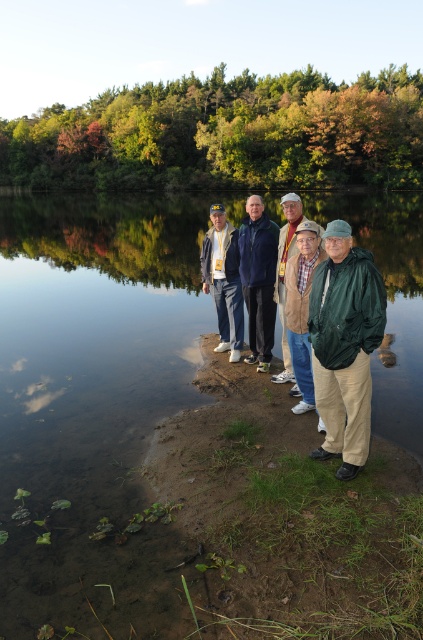
Does clear water at shore center have a smaller size compared to matte blue jacket at center?

No, clear water at shore center is not smaller than matte blue jacket at center.

Consider the image. Is clear water at shore center positioned before matte blue jacket at center?

Yes, it is in front of matte blue jacket at center.

Who is more distant from viewer, (101, 349) or (220, 289)?

The point (101, 349) is behind.

At what (x,y) coordinates should I click in order to perform the action: click on clear water at shore center. Please return your answer as a coordinate pair (x, y). Looking at the image, I should click on (159, 445).

Is point (231, 320) more distant than point (285, 328)?

Yes, point (231, 320) is farther from viewer.

Can you confirm if matte blue jacket at center is smaller than brown leather jacket at center?

No.

Is point (219, 262) positioned behind point (283, 321)?

Yes.

Find the location of a particular element. The width and height of the screenshot is (423, 640). matte blue jacket at center is located at coordinates (224, 280).

Consider the image. Is clear water at shore center above brown leather jacket at center?

Yes, clear water at shore center is above brown leather jacket at center.

Consider the image. Which is more to the left, clear water at shore center or brown leather jacket at center?

brown leather jacket at center

Where is `clear water at shore center`? The image size is (423, 640). clear water at shore center is located at coordinates (159, 445).